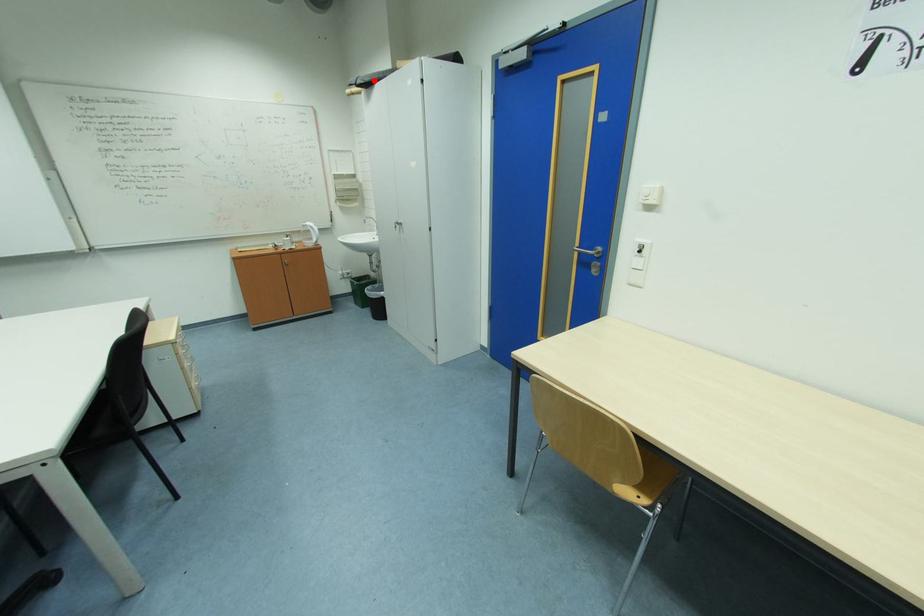
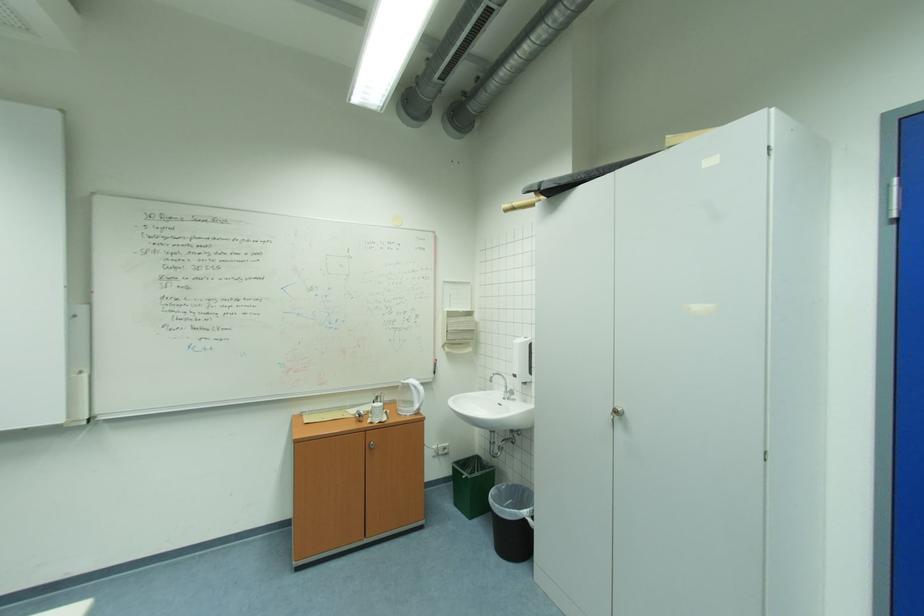
The point at the highlighted location is marked in the first image. Where is the corresponding point in the second image?

(569, 182)